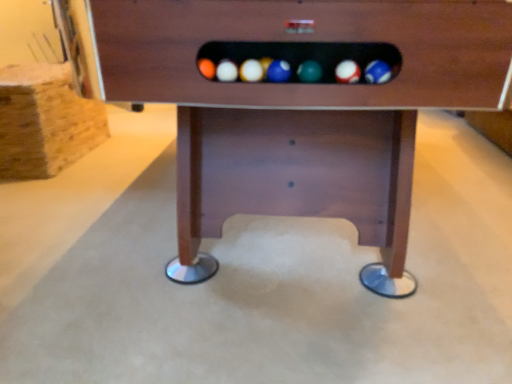
This screenshot has width=512, height=384. What do you see at coordinates (301, 108) in the screenshot?
I see `wooden pool table at center` at bounding box center [301, 108].

Where is `wooden pool table at center`? The height and width of the screenshot is (384, 512). wooden pool table at center is located at coordinates (301, 108).

Locate an element on the screen. This screenshot has width=512, height=384. wooden pool table at center is located at coordinates (301, 108).